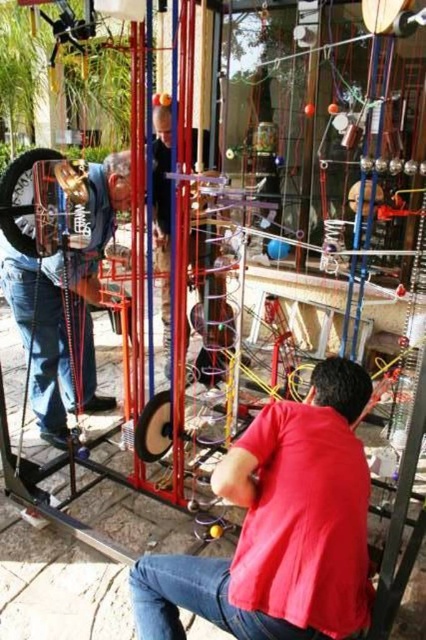
You are standing in front of the kinetic sculpture and want to determine the spatial relationship between two points on the structure. Specifically, you need to know if point 1 at coordinates point (276, 474) is closer to you than point 2 at coordinates point (5, 269). Can you confirm this?

Yes, point (276, 474) is in front of point (5, 269), so it is closer to you.

You are an art curator standing in front of the kinetic sculpture. You notice two individuals wearing shirts of different colors and finishes. The red matte shirt at center and the matte black shirt at center are both visible. Which shirt is positioned lower in the scene?

The red matte shirt at center is located below the matte black shirt at center, so the red matte shirt at center is positioned lower in the scene.